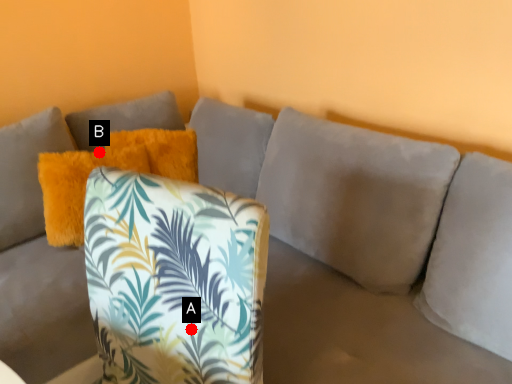
Question: Two points are circled on the image, labeled by A and B beside each circle. Which point appears farthest from the camera in this image?

Choices:
 (A) A is further
 (B) B is further

Answer: (B)